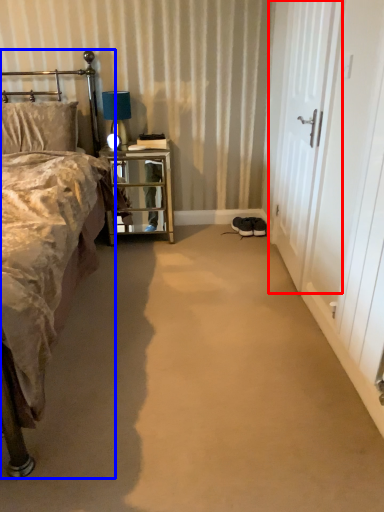
Question: Which point is closer to the camera, screen door (highlighted by a red box) or bed (highlighted by a blue box)?

Choices:
 (A) screen door
 (B) bed

Answer: (B)